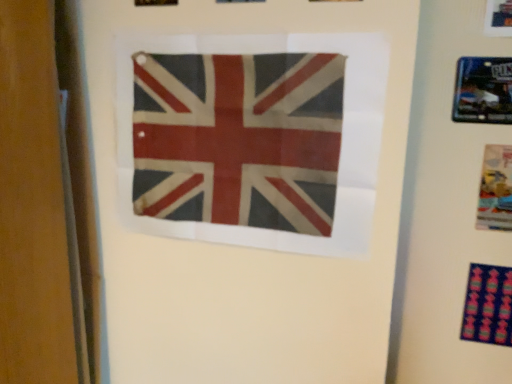
Based on the photo, measure the distance between point [511,170] and camera.

They are 1.02 meters apart.

Describe the element at coordinates (238, 139) in the screenshot. I see `worn fabric flag at center` at that location.

At what (x,y) coordinates should I click in order to perform the action: click on multicolored fabric at lower right. Please return your answer as a coordinate pair (x, y). The image size is (512, 384). Looking at the image, I should click on (488, 305).

Is matte plastic poster at right outside of multicolored fabric at lower right?

Yes, matte plastic poster at right is located beyond the bounds of multicolored fabric at lower right.

Could you tell me if matte plastic poster at right is turned towards multicolored fabric at lower right?

No.

Between matte plastic poster at right and multicolored fabric at lower right, which one appears on the left side from the viewer's perspective?

multicolored fabric at lower right is more to the left.

From a real-world perspective, which is physically above, matte plastic poster at right or multicolored fabric at lower right?

matte plastic poster at right.

From a real-world perspective, is metallic blue picture frame at upper right positioned under worn fabric flag at center based on gravity?

No, from a real-world perspective, metallic blue picture frame at upper right is not under worn fabric flag at center.

Which is behind, metallic blue picture frame at upper right or worn fabric flag at center?

metallic blue picture frame at upper right is more distant.

Is metallic blue picture frame at upper right aimed at worn fabric flag at center?

No.

Consider the image. Which of these two, metallic blue picture frame at upper right or worn fabric flag at center, is thinner?

Thinner between the two is metallic blue picture frame at upper right.

Between multicolored fabric at lower right and matte plastic poster at right, which one has larger width?

Wider between the two is multicolored fabric at lower right.

Looking at this image, can you confirm if multicolored fabric at lower right is positioned to the left of matte plastic poster at right?

Yes.

Is multicolored fabric at lower right directly adjacent to matte plastic poster at right?

No.

Find the location of a particular element. This screenshot has height=384, width=512. poster on the right of multicolored fabric at lower right is located at coordinates (495, 189).

Which of these two, worn fabric flag at center or metallic blue picture frame at upper right, is smaller?

metallic blue picture frame at upper right is smaller.

Could you tell me if worn fabric flag at center is turned towards metallic blue picture frame at upper right?

No, worn fabric flag at center does not turn towards metallic blue picture frame at upper right.

Can you confirm if worn fabric flag at center is thinner than metallic blue picture frame at upper right?

No, worn fabric flag at center is not thinner than metallic blue picture frame at upper right.

Is metallic blue picture frame at upper right wider or thinner than multicolored fabric at lower right?

metallic blue picture frame at upper right is thinner than multicolored fabric at lower right.

How far apart are metallic blue picture frame at upper right and multicolored fabric at lower right?

metallic blue picture frame at upper right and multicolored fabric at lower right are 17.44 inches apart from each other.

Can you confirm if metallic blue picture frame at upper right is smaller than multicolored fabric at lower right?

Actually, metallic blue picture frame at upper right might be larger than multicolored fabric at lower right.

From the picture: Would you say metallic blue picture frame at upper right is outside multicolored fabric at lower right?

metallic blue picture frame at upper right is positioned outside multicolored fabric at lower right.

Is worn fabric flag at center aimed at multicolored fabric at lower right?

No, worn fabric flag at center is not turned towards multicolored fabric at lower right.

How distant is worn fabric flag at center from multicolored fabric at lower right?

worn fabric flag at center and multicolored fabric at lower right are 26.07 inches apart from each other.

Is the position of worn fabric flag at center more distant than that of multicolored fabric at lower right?

That is False.

Find the location of a particular element. print lying below the worn fabric flag at center (from the image's perspective) is located at coordinates (488, 305).

From a real-world perspective, is matte plastic poster at right located higher than worn fabric flag at center?

No, from a real-world perspective, matte plastic poster at right is not above worn fabric flag at center.

Considering the relative sizes of matte plastic poster at right and worn fabric flag at center in the image provided, is matte plastic poster at right thinner than worn fabric flag at center?

Yes.

From the picture: Is matte plastic poster at right bigger than worn fabric flag at center?

No.

Identify the location of poster below the worn fabric flag at center (from the image's perspective). (495, 189).

Identify the location of print located behind the matte plastic poster at right. (488, 305).

I want to click on flag below the metallic blue picture frame at upper right (from the image's perspective), so click(238, 139).

From the image, which object appears to be nearer to metallic blue picture frame at upper right, matte plastic poster at right or worn fabric flag at center?

Among the two, matte plastic poster at right is located nearer to metallic blue picture frame at upper right.

When comparing their distances from metallic blue picture frame at upper right, does multicolored fabric at lower right or matte plastic poster at right seem closer?

matte plastic poster at right lies closer to metallic blue picture frame at upper right than the other object.

Which object lies nearer to the anchor point matte plastic poster at right, metallic blue picture frame at upper right or multicolored fabric at lower right?

Based on the image, metallic blue picture frame at upper right appears to be nearer to matte plastic poster at right.

From the image, which object appears to be farther from metallic blue picture frame at upper right, worn fabric flag at center or multicolored fabric at lower right?

Among the two, worn fabric flag at center is located further to metallic blue picture frame at upper right.

Looking at the image, which one is located further to worn fabric flag at center, matte plastic poster at right or metallic blue picture frame at upper right?

matte plastic poster at right.

Considering their positions, is multicolored fabric at lower right positioned closer to matte plastic poster at right than worn fabric flag at center?

multicolored fabric at lower right is positioned closer to the anchor matte plastic poster at right.

Which object lies nearer to the anchor point multicolored fabric at lower right, worn fabric flag at center or matte plastic poster at right?

matte plastic poster at right is closer to multicolored fabric at lower right.

Looking at the image, which one is located further to worn fabric flag at center, multicolored fabric at lower right or metallic blue picture frame at upper right?

The object further to worn fabric flag at center is multicolored fabric at lower right.

Where is `print between worn fabric flag at center and metallic blue picture frame at upper right in the horizontal direction`? Image resolution: width=512 pixels, height=384 pixels. print between worn fabric flag at center and metallic blue picture frame at upper right in the horizontal direction is located at coordinates (488, 305).

At what (x,y) coordinates should I click in order to perform the action: click on poster between worn fabric flag at center and metallic blue picture frame at upper right from left to right. Please return your answer as a coordinate pair (x, y). Looking at the image, I should click on (495, 189).

You are a GUI agent. You are given a task and a screenshot of the screen. Output one action in this format:
    pyautogui.click(x=<x>, y=<y>)
    Task: Click on the poster between metallic blue picture frame at upper right and multicolored fabric at lower right in the up-down direction
    
    Given the screenshot: What is the action you would take?
    pyautogui.click(x=495, y=189)

Identify the location of print between worn fabric flag at center and matte plastic poster at right in the horizontal direction. This screenshot has width=512, height=384. (x=488, y=305).